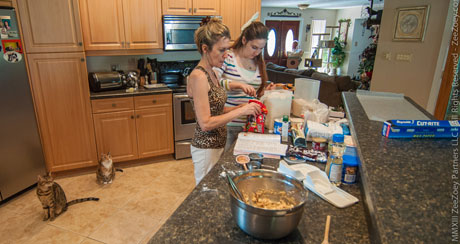
Where is `baking sheet`? The width and height of the screenshot is (460, 244). baking sheet is located at coordinates (412, 112).